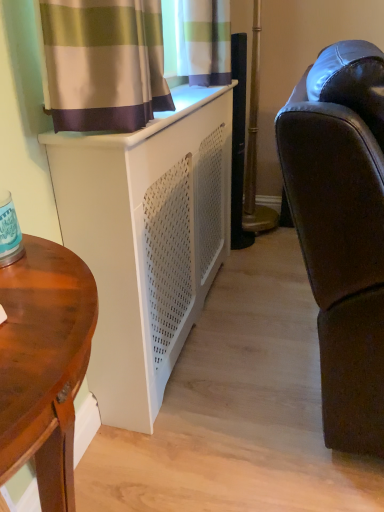
You are a GUI agent. You are given a task and a screenshot of the screen. Output one action in this format:
    pyautogui.click(x=<x>, y=<y>)
    Task: Click on the empty space that is ontop of wooden desk at left (from a real-world perspective)
    
    Given the screenshot: What is the action you would take?
    pyautogui.click(x=39, y=290)